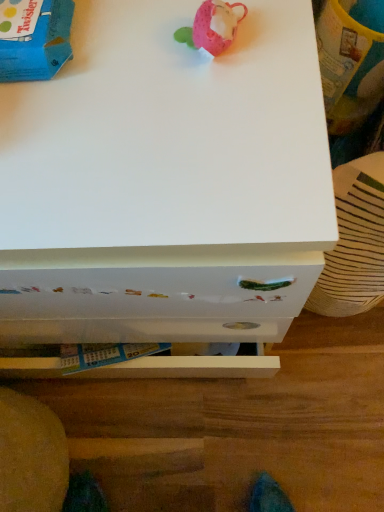
At what (x,y) coordinates should I click in order to perform the action: click on blank space situated above white glossy drawer at lower center (from a real-world perspective). Please return your answer as a coordinate pair (x, y). This screenshot has width=384, height=512. Looking at the image, I should click on (215, 419).